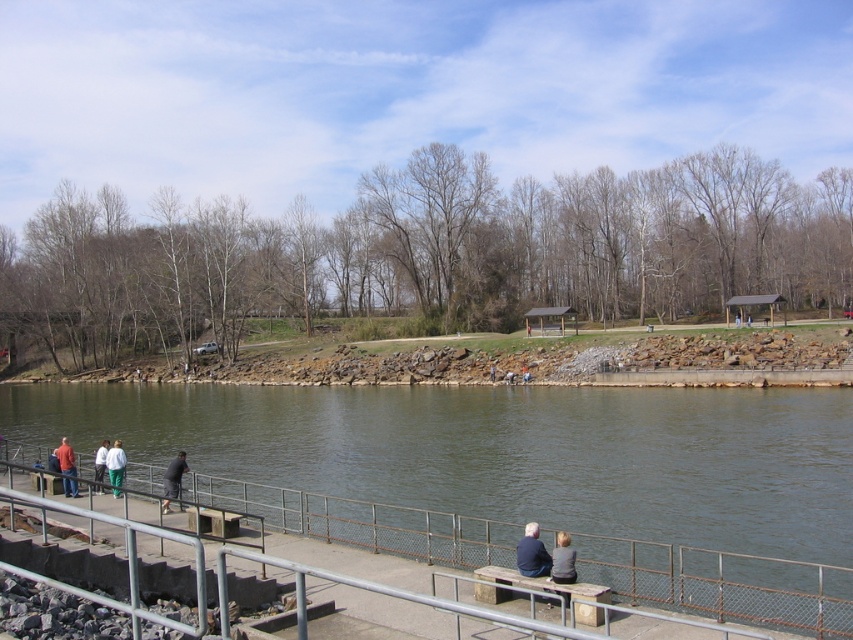
Question: Which of the following is the farthest from the observer?

Choices:
 (A) matte red shirt at left
 (B) blue denim jacket at lower center

Answer: (A)

Question: Which point is farther from the camera taking this photo?

Choices:
 (A) (178, 484)
 (B) (527, 532)
 (C) (561, 577)

Answer: (A)

Question: Which object is closer to the camera taking this photo?

Choices:
 (A) matte red shirt at left
 (B) white cotton pants at lower left

Answer: (A)

Question: Can you confirm if metal/smooth rail at lower center is wider than white cotton pants at lower left?

Choices:
 (A) yes
 (B) no

Answer: (A)

Question: Considering the relative positions of metal/smooth rail at lower center and white cotton shirt at lower left in the image provided, where is metal/smooth rail at lower center located with respect to white cotton shirt at lower left?

Choices:
 (A) right
 (B) left

Answer: (A)

Question: Does blue denim jacket at lower center have a lesser width compared to white cotton shirt at lower left?

Choices:
 (A) yes
 (B) no

Answer: (A)